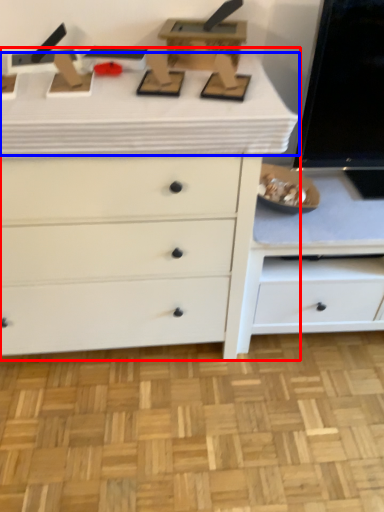
Question: Which object is closer to the camera taking this photo, chest of drawers (highlighted by a red box) or counter top (highlighted by a blue box)?

Choices:
 (A) chest of drawers
 (B) counter top

Answer: (B)